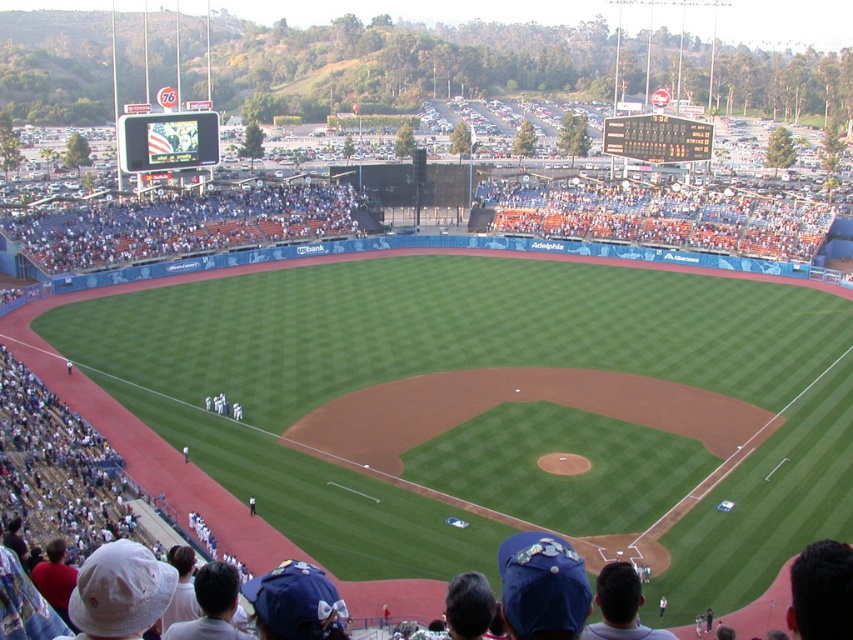
Question: Which object appears farthest from the camera in this image?

Choices:
 (A) white uniform at center
 (B) blue fabric seats at center

Answer: (B)

Question: Which object appears closest to the camera in this image?

Choices:
 (A) blue fabric seats at center
 (B) white uniform at center

Answer: (B)

Question: Which point appears closest to the camera in this image?

Choices:
 (A) (158, 204)
 (B) (236, 410)

Answer: (B)

Question: Does blue fabric seats at center appear under white uniform at center?

Choices:
 (A) yes
 (B) no

Answer: (B)

Question: Does blue fabric seats at center appear on the right side of white uniform at center?

Choices:
 (A) no
 (B) yes

Answer: (A)

Question: Is blue fabric seats at center above white uniform at center?

Choices:
 (A) yes
 (B) no

Answer: (A)